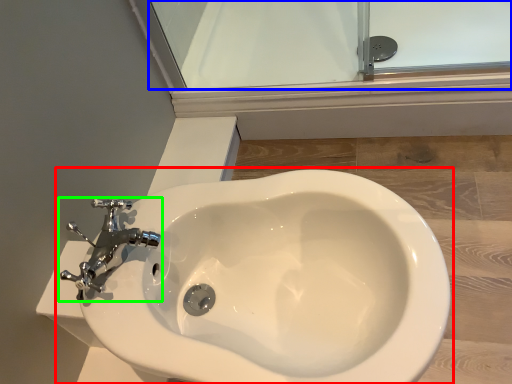
Question: Estimate the real-world distances between objects in this image. Which object is farther from toilet (highlighted by a red box), glass door (highlighted by a blue box) or tap (highlighted by a green box)?

Choices:
 (A) glass door
 (B) tap

Answer: (A)